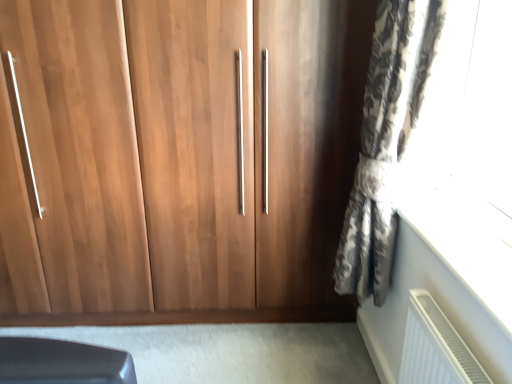
Question: Should I look upward or downward to see patterned fabric curtain at right?

Choices:
 (A) down
 (B) up

Answer: (B)